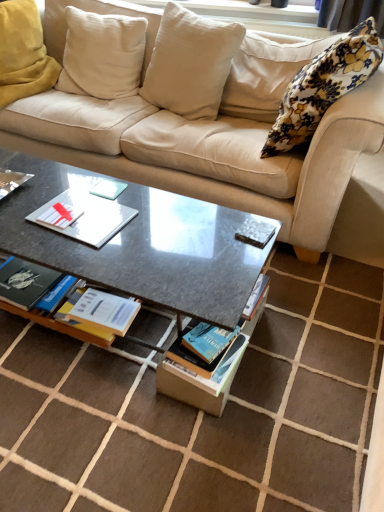
In order to click on free area behind metallic silver book at left, which is the second book in right-to-left order in this screenshot , I will do `click(27, 165)`.